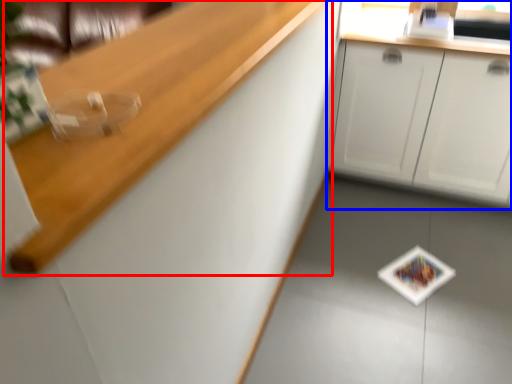
Question: Which object is closer to the camera taking this photo, counter top (highlighted by a red box) or cabinetry (highlighted by a blue box)?

Choices:
 (A) counter top
 (B) cabinetry

Answer: (A)